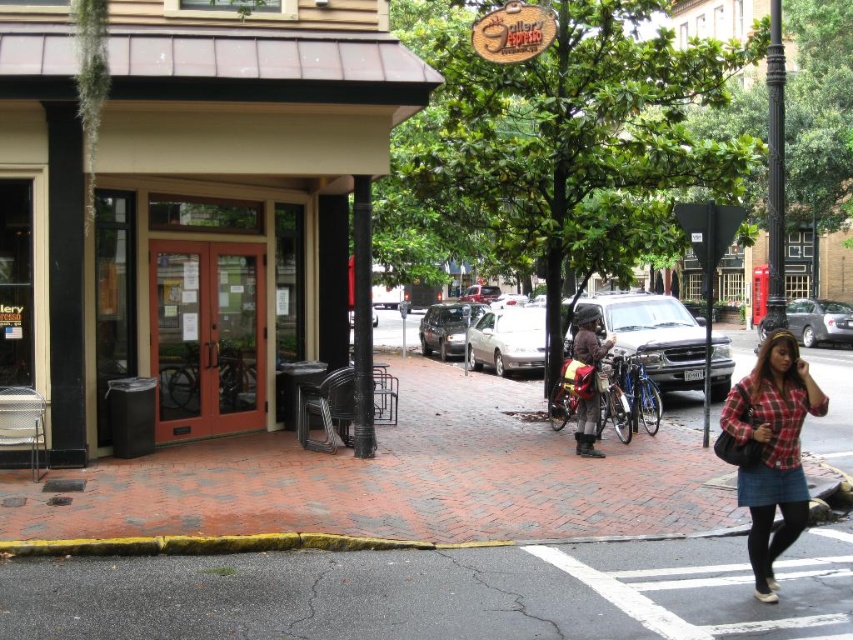
Which of these two, plaid shirt at center or metallic silver sedan at center, stands shorter?

metallic silver sedan at center is shorter.

This screenshot has width=853, height=640. I want to click on plaid shirt at center, so click(x=772, y=449).

Locate an element on the screen. The width and height of the screenshot is (853, 640). plaid shirt at center is located at coordinates (772, 449).

Is brown wood door at center to the right of satin black sedan at center from the viewer's perspective?

In fact, brown wood door at center is to the left of satin black sedan at center.

Is brown wood door at center positioned at the back of satin black sedan at center?

No, brown wood door at center is in front of satin black sedan at center.

Does point (115, 61) come closer to viewer compared to point (460, 310)?

Yes, point (115, 61) is in front of point (460, 310).

At what (x,y) coordinates should I click in order to perform the action: click on brown wood door at center. Please return your answer as a coordinate pair (x, y). Image resolution: width=853 pixels, height=640 pixels. Looking at the image, I should click on (189, 202).

Does brown wood door at center have a greater height compared to silver metallic sedan at right?

Indeed, brown wood door at center has a greater height compared to silver metallic sedan at right.

Does brown wood door at center lie behind silver metallic sedan at right?

No.

Who is more distant from viewer, (167,284) or (804,317)?

The point (804,317) is more distant.

This screenshot has width=853, height=640. Find the location of `brown wood door at center`. brown wood door at center is located at coordinates (189, 202).